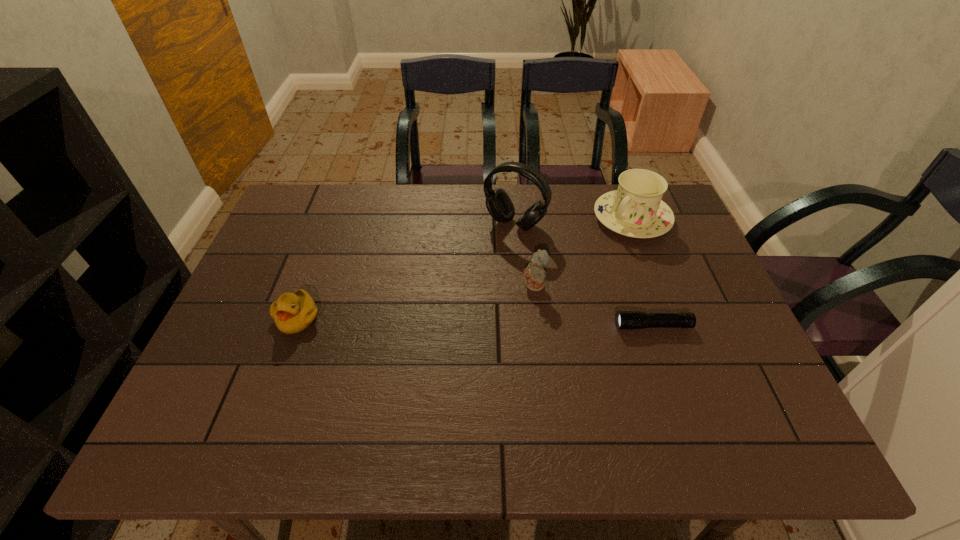
Select which object is the third closest to the third farthest object. Please provide its 2D coordinates. Your answer should be formatted as a tuple, i.e. [(x, y)], where the tuple contains the x and y coordinates of a point satisfying the conditions above.

[(636, 210)]

The width and height of the screenshot is (960, 540). I want to click on object that ranks as the second closest to the teddy bear, so click(625, 320).

Locate an element on the screen. The width and height of the screenshot is (960, 540). vacant space that satisfies the following two spatial constraints: 1. on the front side of the flashlight; 2. at the lens end of the teddy bear is located at coordinates (539, 326).

You are a GUI agent. You are given a task and a screenshot of the screen. Output one action in this format:
    pyautogui.click(x=<x>, y=<y>)
    Task: Click on the blank area in the image that satisfies the following two spatial constraints: 1. on the front-facing side of the flashlight; 2. at the lens end of the duckling
    The width and height of the screenshot is (960, 540).
    Given the screenshot: What is the action you would take?
    pyautogui.click(x=295, y=326)

I want to click on vacant space that satisfies the following two spatial constraints: 1. on the front-facing side of the second shortest object; 2. at the lens end of the flashlight, so click(x=295, y=326).

This screenshot has width=960, height=540. Identify the location of free spot that satisfies the following two spatial constraints: 1. on the front side of the tallest object; 2. at the lens end of the flashlight. (523, 326).